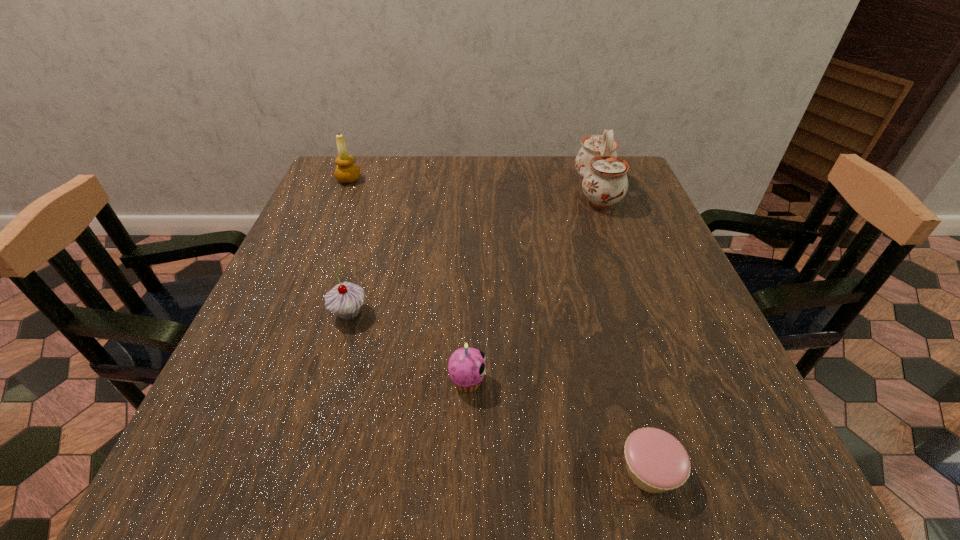
Image resolution: width=960 pixels, height=540 pixels. I want to click on empty space between the chinaware and the second nearest object, so click(x=532, y=286).

The width and height of the screenshot is (960, 540). In order to click on object that is the second closest to the shortest object in this screenshot , I will do `click(345, 299)`.

Where is `object identified as the fourth closest to the chinaware`? This screenshot has height=540, width=960. object identified as the fourth closest to the chinaware is located at coordinates (656, 461).

Select which cupcake is the second closest to the second object from left to right. Please provide its 2D coordinates. Your answer should be formatted as a tuple, i.e. [(x, y)], where the tuple contains the x and y coordinates of a point satisfying the conditions above.

[(656, 461)]

Identify which cupcake is the nearest to the fourth object from right to left. Please provide its 2D coordinates. Your answer should be formatted as a tuple, i.e. [(x, y)], where the tuple contains the x and y coordinates of a point satisfying the conditions above.

[(466, 367)]

Where is `free spot that satisfies the following two spatial constraints: 1. on the face of the second cupcake from right to left; 2. on the back side of the shortest cupcake`? Image resolution: width=960 pixels, height=540 pixels. free spot that satisfies the following two spatial constraints: 1. on the face of the second cupcake from right to left; 2. on the back side of the shortest cupcake is located at coordinates (466, 471).

Locate an element on the screen. Image resolution: width=960 pixels, height=540 pixels. free space that satisfies the following two spatial constraints: 1. on the face of the rightmost cupcake; 2. on the left side of the third object from right to left is located at coordinates (466, 471).

Where is `free location that satisfies the following two spatial constraints: 1. by the handle of the chinaware; 2. on the front side of the shortest object`? Image resolution: width=960 pixels, height=540 pixels. free location that satisfies the following two spatial constraints: 1. by the handle of the chinaware; 2. on the front side of the shortest object is located at coordinates (697, 471).

In order to click on free space that satisfies the following two spatial constraints: 1. on the face of the rightmost cupcake; 2. on the left side of the second nearest cupcake in this screenshot , I will do `click(466, 471)`.

This screenshot has width=960, height=540. Identify the location of free space that satisfies the following two spatial constraints: 1. on the face of the nearest cupcake; 2. on the right side of the second nearest object. (466, 471).